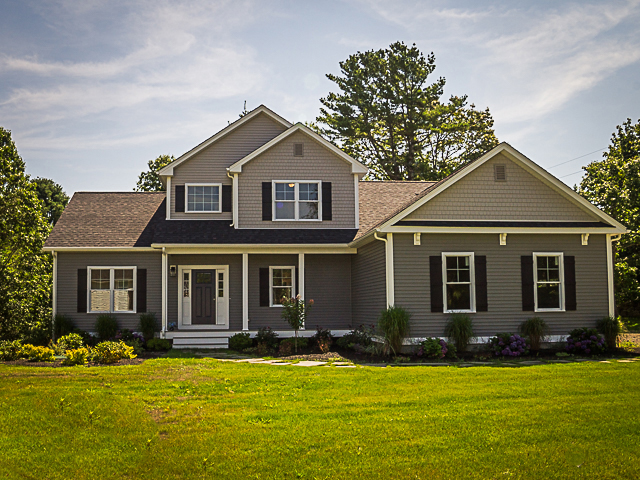
You are a GUI agent. You are given a task and a screenshot of the screen. Output one action in this format:
    pyautogui.click(x=<x>, y=<y>)
    Task: Click on the windows on the house
    Image resolution: width=640 pixels, height=480 pixels.
    Given the screenshot: What is the action you would take?
    pyautogui.click(x=100, y=294), pyautogui.click(x=127, y=290), pyautogui.click(x=187, y=285), pyautogui.click(x=221, y=283), pyautogui.click(x=196, y=195), pyautogui.click(x=285, y=205), pyautogui.click(x=310, y=206), pyautogui.click(x=283, y=284), pyautogui.click(x=454, y=289), pyautogui.click(x=561, y=285)